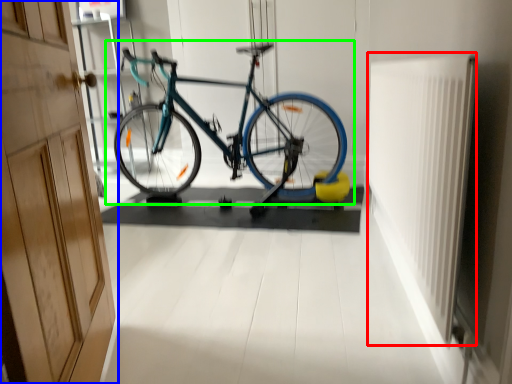
Question: Which is farther away from radiator (highlighted by a red box)? door (highlighted by a blue box) or bicycle (highlighted by a green box)?

Choices:
 (A) door
 (B) bicycle

Answer: (B)